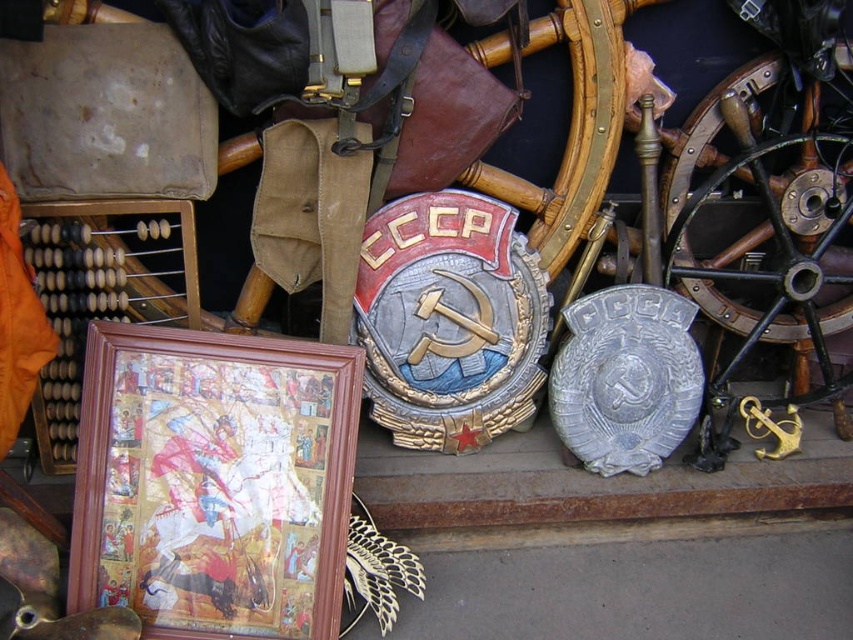
Based on the photo, which of these two, wooden frame at lower left or polished brass wheel at right, stands shorter?

wooden frame at lower left

Is point (190, 410) positioned in front of point (759, 243)?

That is True.

This screenshot has height=640, width=853. I want to click on wooden frame at lower left, so click(213, 481).